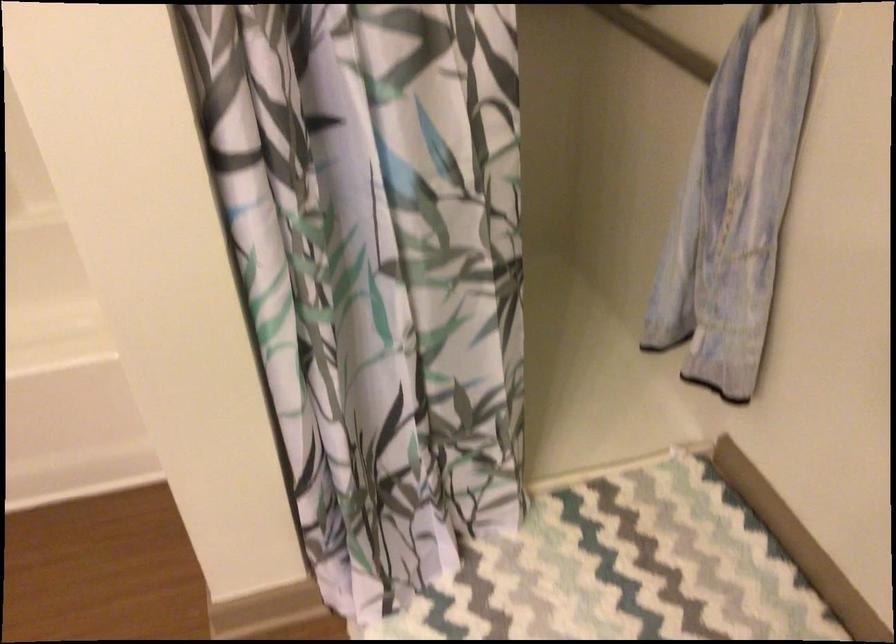
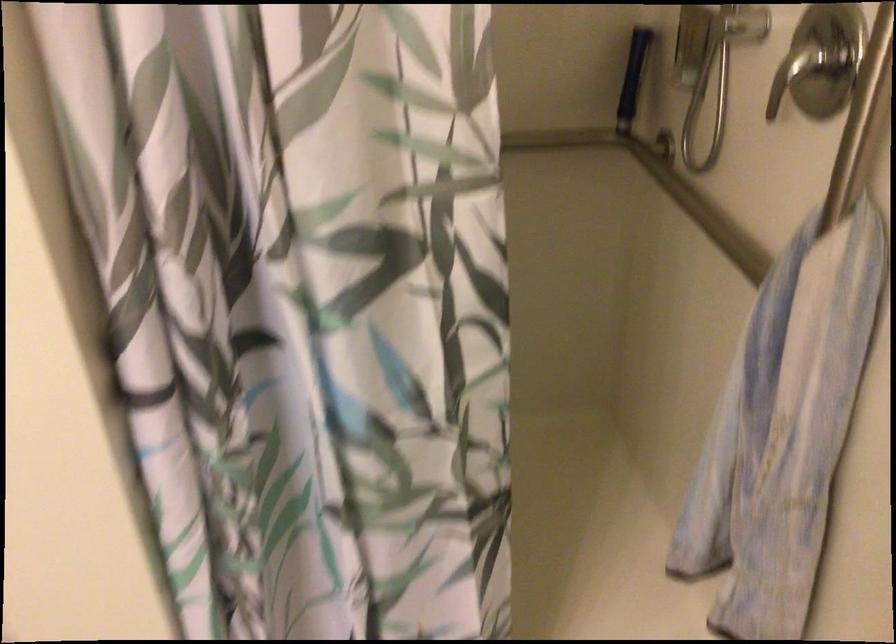
Question: The camera is either moving clockwise (left) or counter-clockwise (right) around the object. The first image is from the beginning of the video and the second image is from the end. Is the camera moving left or right when shooting the video?

Choices:
 (A) Left
 (B) Right

Answer: (B)